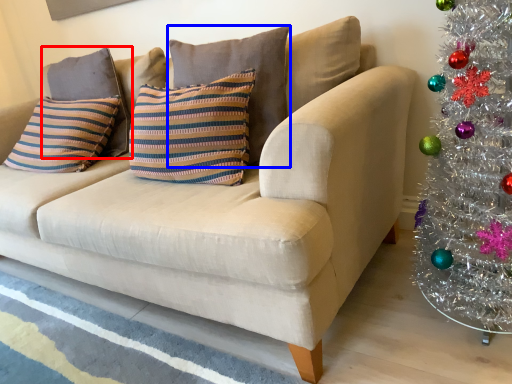
Question: Which of the following is the farthest to the observer, pillow (highlighted by a red box) or pillow (highlighted by a blue box)?

Choices:
 (A) pillow
 (B) pillow

Answer: (A)